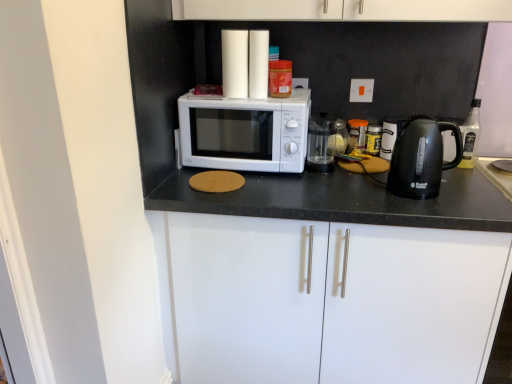
What are the coordinates of `vacant space underneath black plastic kettle at right (from a real-world perspective)` in the screenshot? It's located at (433, 193).